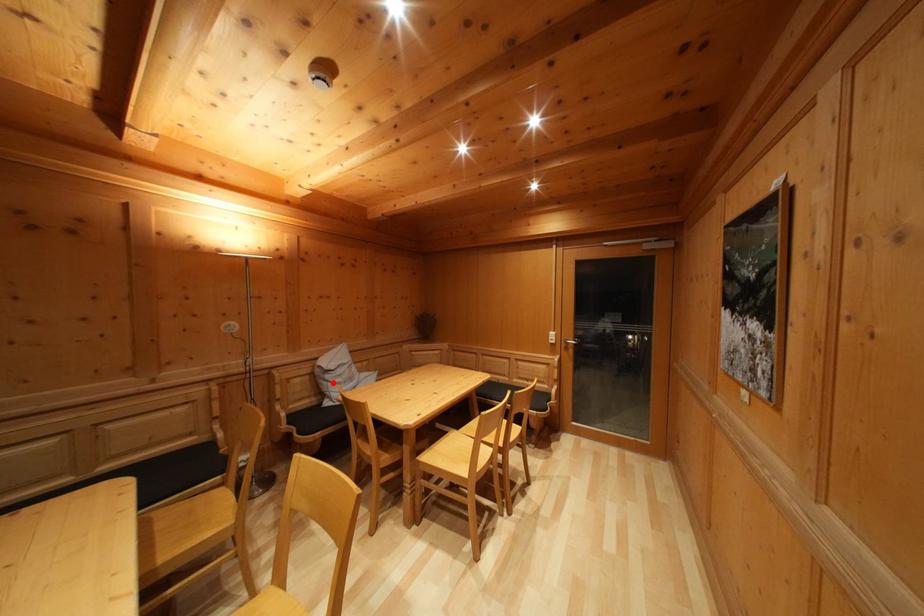
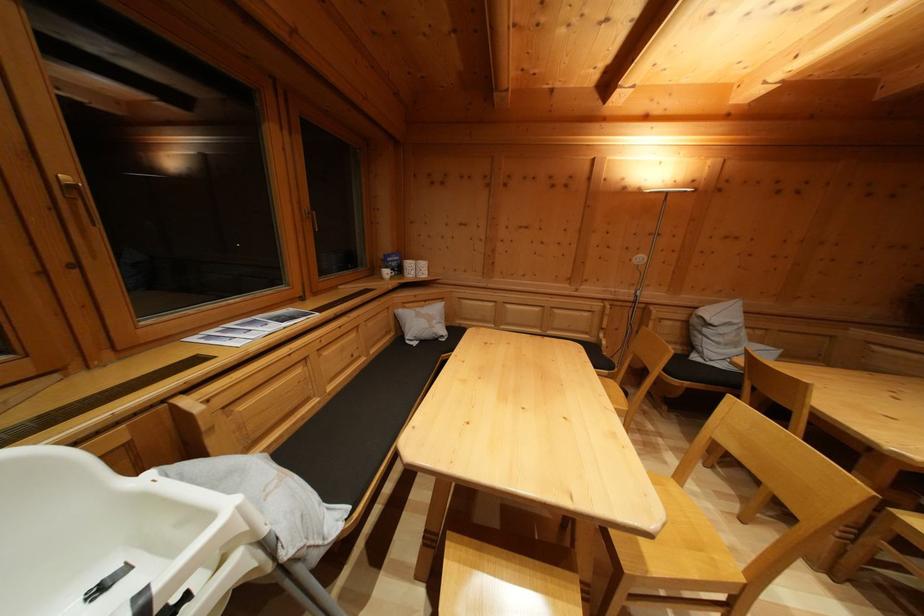
Question: I am providing you with two images of the same scene from different viewpoints. A red point is marked on the first image. Is the red point's position out of view in image 2?

Choices:
 (A) Yes
 (B) No

Answer: (B)